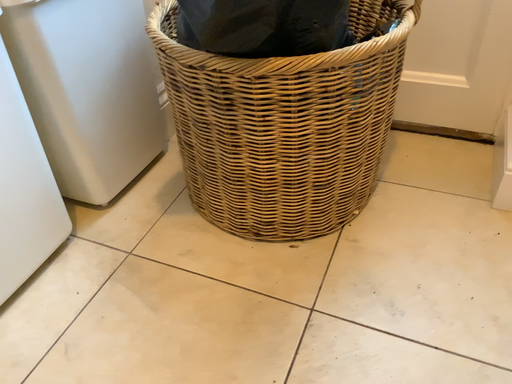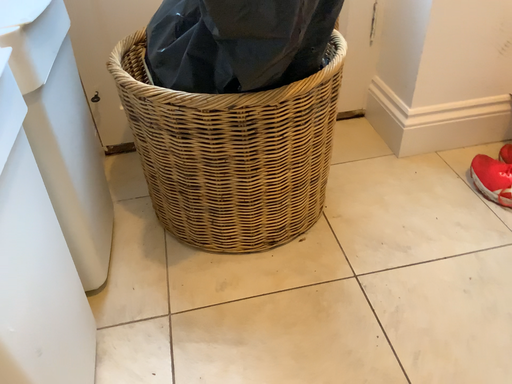
Question: How did the camera likely rotate when shooting the video?

Choices:
 (A) rotated right
 (B) rotated left

Answer: (A)